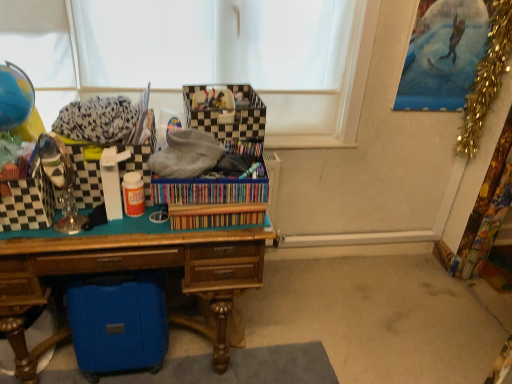
Question: Is gold tinsel garland at upper right thinner than checkered plastic storage box at left, the third storage box positioned from the bottom?

Choices:
 (A) yes
 (B) no

Answer: (A)

Question: From a real-world perspective, is gold tinsel garland at upper right on checkered plastic storage box at left, the third storage box positioned from the bottom?

Choices:
 (A) no
 (B) yes

Answer: (B)

Question: Can you confirm if gold tinsel garland at upper right is smaller than checkered plastic storage box at left, the third storage box positioned from the bottom?

Choices:
 (A) no
 (B) yes

Answer: (B)

Question: Can you see gold tinsel garland at upper right touching checkered plastic storage box at left, the third storage box positioned from the bottom?

Choices:
 (A) no
 (B) yes

Answer: (A)

Question: Does gold tinsel garland at upper right appear on the right side of checkered plastic storage box at left, the third storage box positioned from the bottom?

Choices:
 (A) yes
 (B) no

Answer: (A)

Question: Is gold tinsel garland at upper right positioned far away from checkered plastic storage box at left, the third storage box positioned from the bottom?

Choices:
 (A) no
 (B) yes

Answer: (B)

Question: Considering the relative sizes of blue fabric suitcase at lower left, positioned as the 4th storage box in top-to-bottom order, and checkered fabric storage box at center, acting as the fourth storage box starting from the bottom, in the image provided, is blue fabric suitcase at lower left, positioned as the 4th storage box in top-to-bottom order, thinner than checkered fabric storage box at center, acting as the fourth storage box starting from the bottom,?

Choices:
 (A) no
 (B) yes

Answer: (B)

Question: Considering the relative sizes of blue fabric suitcase at lower left, positioned as the 4th storage box in top-to-bottom order, and checkered fabric storage box at center, acting as the fourth storage box starting from the bottom, in the image provided, is blue fabric suitcase at lower left, positioned as the 4th storage box in top-to-bottom order, wider than checkered fabric storage box at center, acting as the fourth storage box starting from the bottom,?

Choices:
 (A) no
 (B) yes

Answer: (A)

Question: Does blue fabric suitcase at lower left, the first storage box positioned from the bottom, have a larger size compared to checkered fabric storage box at center, which appears as the first storage box when viewed from the top?

Choices:
 (A) yes
 (B) no

Answer: (A)

Question: From a real-world perspective, is blue fabric suitcase at lower left, positioned as the 4th storage box in top-to-bottom order, over checkered fabric storage box at center, acting as the fourth storage box starting from the bottom?

Choices:
 (A) no
 (B) yes

Answer: (A)

Question: Is the depth of blue fabric suitcase at lower left, positioned as the 4th storage box in top-to-bottom order, greater than that of checkered fabric storage box at center, which appears as the first storage box when viewed from the top?

Choices:
 (A) yes
 (B) no

Answer: (B)

Question: Considering the relative sizes of blue fabric suitcase at lower left, positioned as the 4th storage box in top-to-bottom order, and checkered fabric storage box at center, acting as the fourth storage box starting from the bottom, in the image provided, is blue fabric suitcase at lower left, positioned as the 4th storage box in top-to-bottom order, smaller than checkered fabric storage box at center, acting as the fourth storage box starting from the bottom,?

Choices:
 (A) no
 (B) yes

Answer: (A)

Question: Are gold tinsel garland at upper right and blue fabric suitcase at lower left, positioned as the 4th storage box in top-to-bottom order, far apart?

Choices:
 (A) no
 (B) yes

Answer: (B)